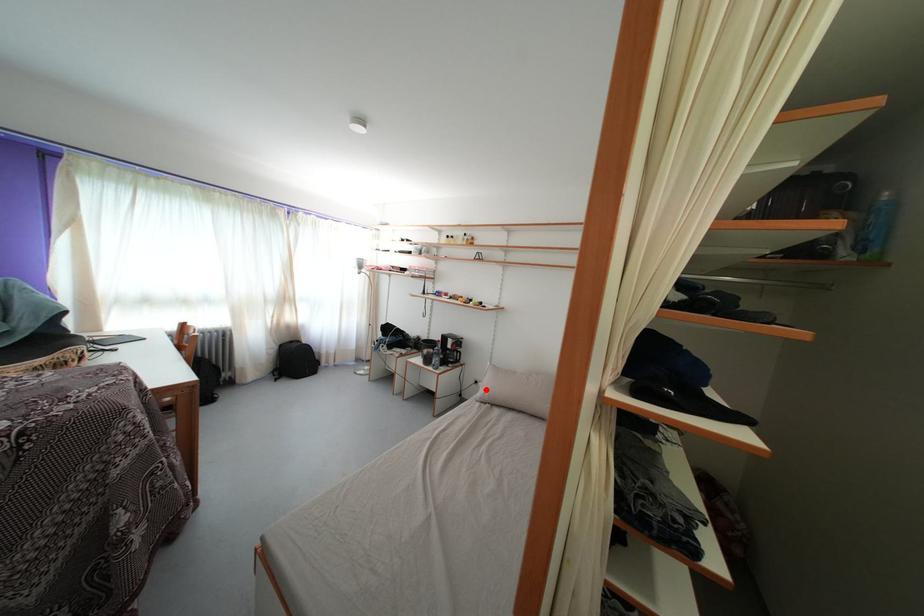
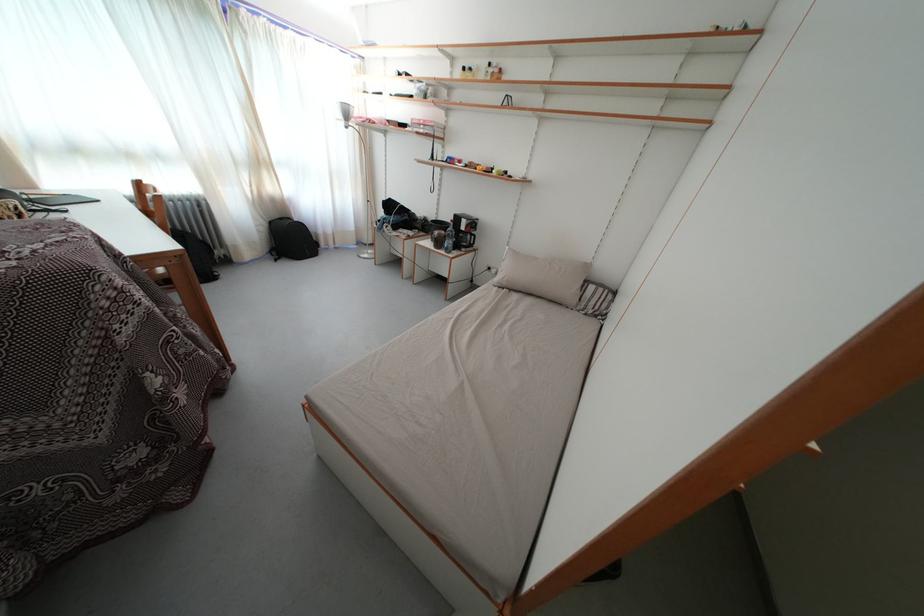
Find the pixel in the second image that matches the highlighted location in the first image.

(500, 276)